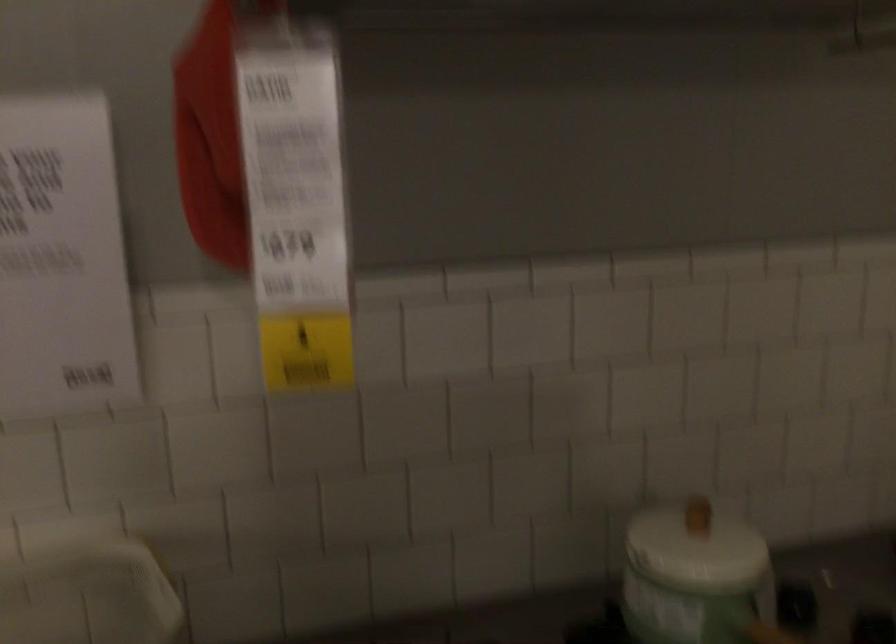
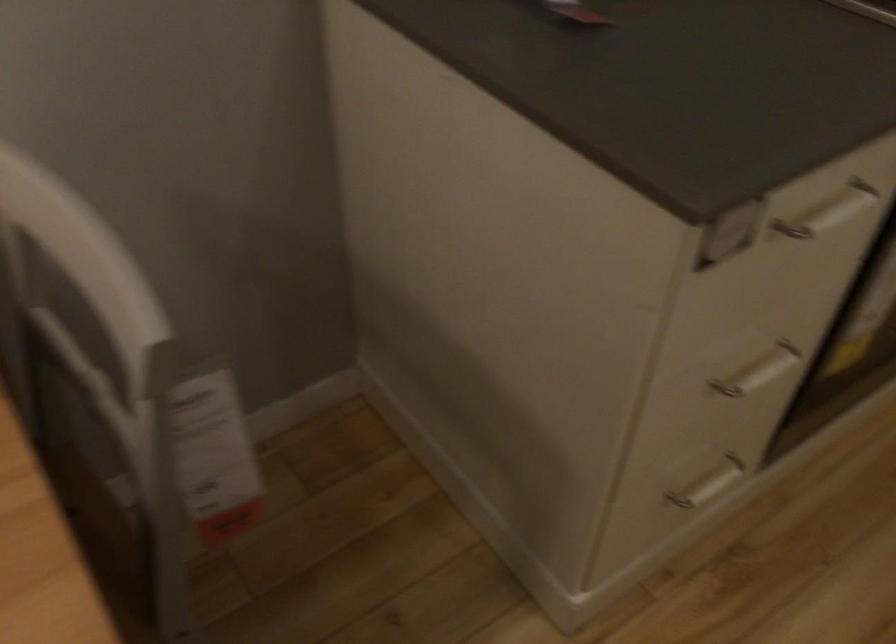
First-person continuous shooting, in which direction is the camera rotating?

The camera's rotation is toward right-down.